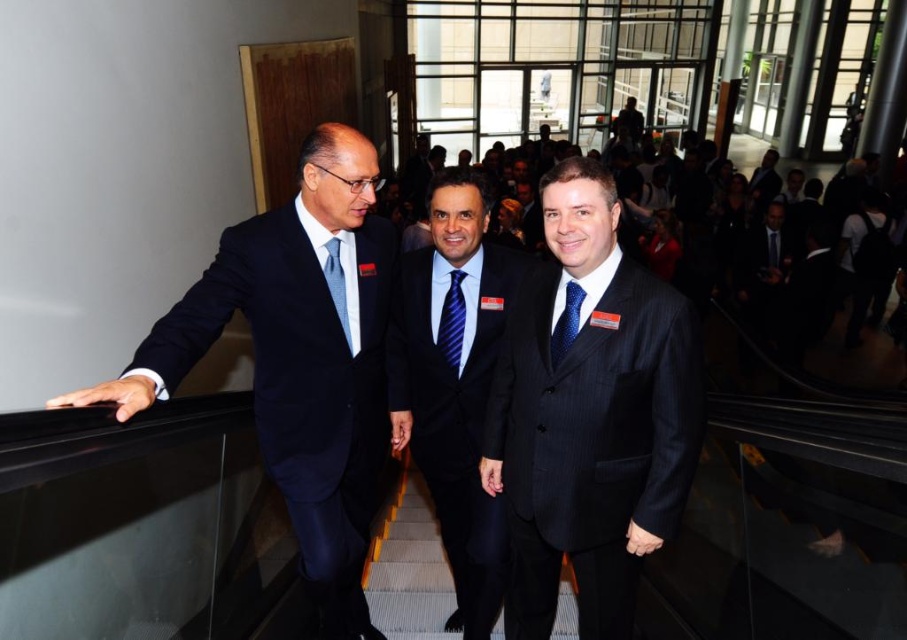
Between dark blue pinstripe suit at center and dark blue suit at upper right, which one appears on the left side from the viewer's perspective?

Positioned to the left is dark blue pinstripe suit at center.

Between dark blue pinstripe suit at center and dark blue suit at upper right, which one appears on the right side from the viewer's perspective?

dark blue suit at upper right

Who is more forward, (501, 563) or (767, 195)?

Point (501, 563)

The image size is (907, 640). I want to click on dark blue pinstripe suit at center, so click(x=454, y=381).

Is matte black suit at left positioned before light blue silk tie at left?

Yes, it is in front of light blue silk tie at left.

Does matte black suit at left appear on the right side of light blue silk tie at left?

Incorrect, matte black suit at left is not on the right side of light blue silk tie at left.

Between point (324, 378) and point (333, 243), which one is positioned in front?

Positioned in front is point (333, 243).

At what (x,y) coordinates should I click in order to perform the action: click on matte black suit at left. Please return your answer as a coordinate pair (x, y). The height and width of the screenshot is (640, 907). Looking at the image, I should click on (298, 360).

Is blue dotted tie at center thinner than blue silk tie at center?

Indeed, blue dotted tie at center has a lesser width compared to blue silk tie at center.

Does point (571, 291) lie behind point (772, 241)?

No, it is in front of (772, 241).

You are a GUI agent. You are given a task and a screenshot of the screen. Output one action in this format:
    pyautogui.click(x=<x>, y=<y>)
    Task: Click on the blue dotted tie at center
    This screenshot has height=640, width=907.
    Given the screenshot: What is the action you would take?
    pyautogui.click(x=566, y=323)